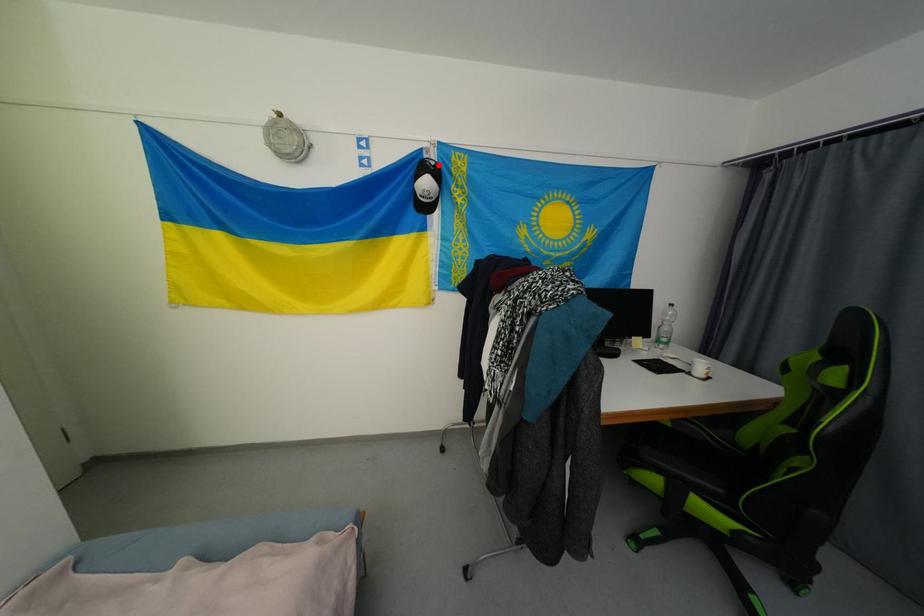
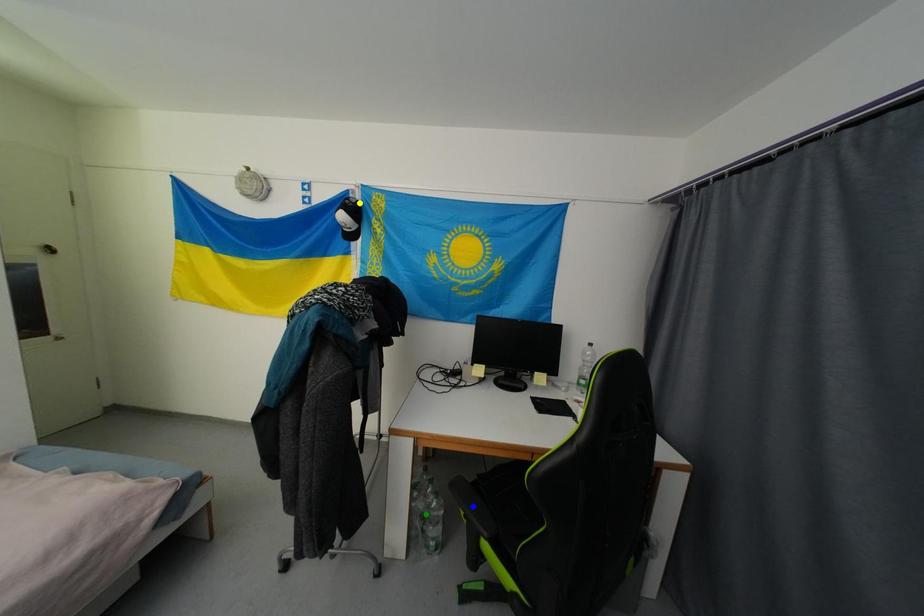
Question: I am providing you with two images of the same scene from different viewpoints. A red point is marked on the first image. You are given multiple points on the second image. In image 2, which mark is for the same physical point as the one in image 1?

Choices:
 (A) yellow point
 (B) blue point
 (C) green point

Answer: (A)